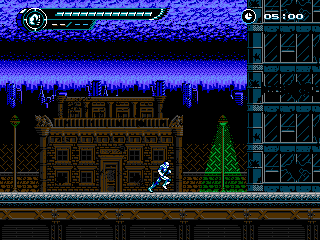
Where is `last part of the gif shows dark door`? This screenshot has width=320, height=240. last part of the gif shows dark door is located at coordinates pos(197,169).